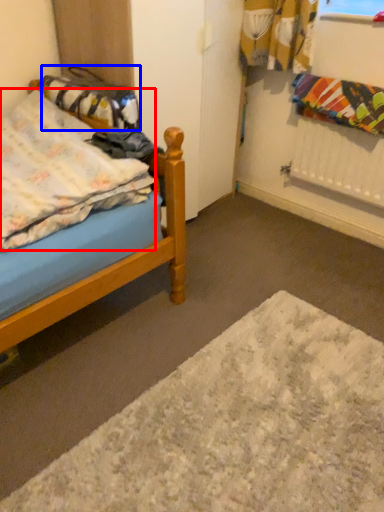
Question: Which point is closer to the camera, blanket (highlighted by a red box) or material (highlighted by a blue box)?

Choices:
 (A) blanket
 (B) material

Answer: (A)